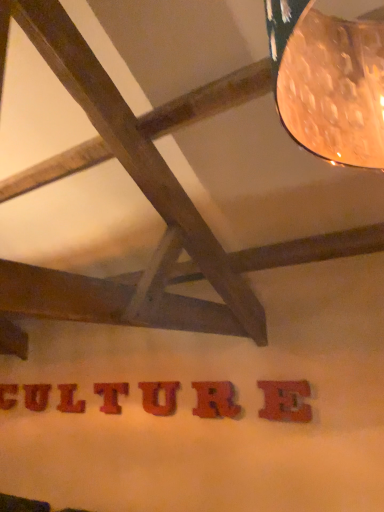
Question: Is wooden textured letter t at center, placed as the fourth letter when sorted from back to front, at the back of red wood letter at center, which appears as the 3th letter when viewed from the back?

Choices:
 (A) yes
 (B) no

Answer: (B)

Question: Is red wood letter at center, which is the 5th letter in right-to-left order, closer to the viewer compared to wooden textured letter t at center, which appears as the 4th letter when viewed from the left?

Choices:
 (A) yes
 (B) no

Answer: (B)

Question: From the image's perspective, would you say red wood letter at center, which is the 5th letter in right-to-left order, is shown under wooden textured letter t at center, placed as the fourth letter when sorted from back to front?

Choices:
 (A) no
 (B) yes

Answer: (B)

Question: Does red wood letter at center, the 3th letter when ordered from left to right, turn towards wooden textured letter t at center, which is the fourth letter in front-to-back order?

Choices:
 (A) yes
 (B) no

Answer: (B)

Question: Can you confirm if red wood letter at center, acting as the fifth letter starting from the front, is thinner than wooden textured letter t at center, which ranks as the 4th letter in right-to-left order?

Choices:
 (A) yes
 (B) no

Answer: (B)

Question: Does point pos(13,401) appear closer or farther from the camera than point pos(84,406)?

Choices:
 (A) farther
 (B) closer

Answer: (A)

Question: Would you say red wood letter at lower center, the 7th letter positioned from the right, is inside or outside red wood letter at center, which is the 5th letter in right-to-left order?

Choices:
 (A) outside
 (B) inside

Answer: (A)

Question: Looking at their shapes, would you say red wood letter at lower center, marked as the first letter in a back-to-front arrangement, is wider or thinner than red wood letter at center, acting as the fifth letter starting from the front?

Choices:
 (A) wide
 (B) thin

Answer: (A)

Question: Considering the positions of red wood letter at lower center, placed as the 7th letter when sorted from front to back, and red wood letter at center, the 3th letter when ordered from left to right, in the image, is red wood letter at lower center, placed as the 7th letter when sorted from front to back, taller or shorter than red wood letter at center, the 3th letter when ordered from left to right,?

Choices:
 (A) short
 (B) tall

Answer: (A)

Question: Is red wood letter at center, arranged as the 2th letter when viewed from the back, in front of or behind wooden letter u at center, marked as the 3th letter in a right-to-left arrangement, in the image?

Choices:
 (A) behind
 (B) front

Answer: (A)

Question: Based on their sizes in the image, would you say red wood letter at center, the sixth letter viewed from the front, is bigger or smaller than wooden letter u at center, acting as the third letter starting from the front?

Choices:
 (A) small
 (B) big

Answer: (A)

Question: In the image, is red wood letter at center, the sixth letter viewed from the front, on the left side or the right side of wooden letter u at center, marked as the 3th letter in a right-to-left arrangement?

Choices:
 (A) right
 (B) left

Answer: (B)

Question: Considering the positions of point (23, 394) and point (152, 395), is point (23, 394) closer or farther from the camera than point (152, 395)?

Choices:
 (A) closer
 (B) farther

Answer: (B)

Question: In terms of size, does rubberized red letter r at center, which appears as the 2th letter when viewed from the right, appear bigger or smaller than wooden letter u at center, acting as the 5th letter starting from the back?

Choices:
 (A) small
 (B) big

Answer: (B)

Question: In terms of width, does rubberized red letter r at center, acting as the 6th letter starting from the left, look wider or thinner when compared to wooden letter u at center, acting as the 5th letter starting from the back?

Choices:
 (A) thin
 (B) wide

Answer: (B)